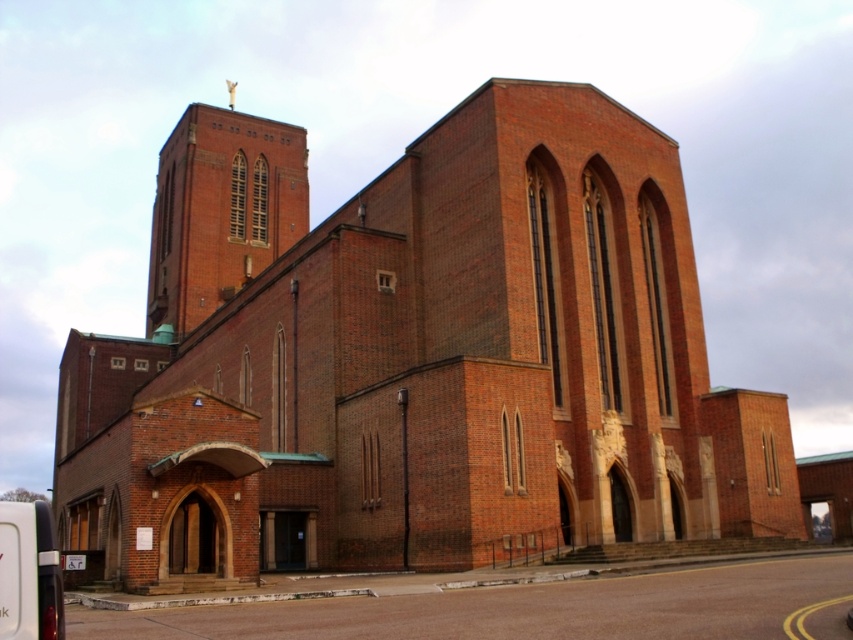
You are standing in a park across from the red brick church at center. You want to take a photo of the church from this spot. The recommended minimum distance for capturing the entire church in a single frame is 40 meters. Will you be able to capture the entire church in your photo from your current position?

The red brick church at center is 41.90 meters away from the camera. Since the recommended minimum distance is 40 meters, you are slightly beyond the required distance, so you should be able to capture the entire church in a single frame from your current position.

You are standing in front of the red brick church at center and looking towards the brick tower at upper center. Which object is positioned higher in the image?

The brick tower at upper center is positioned higher than the red brick church at center in the image.